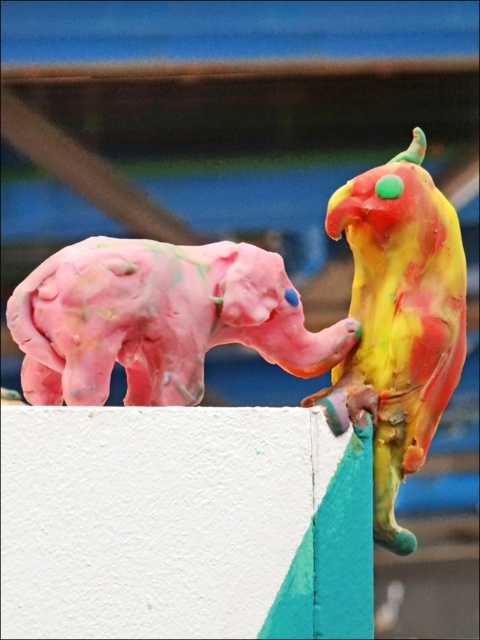
Question: Among these objects, which one is nearest to the camera?

Choices:
 (A) pink clay elephant at upper left
 (B) multicolored clay parrot at upper right
 (C) matte clay elephant at upper left

Answer: (A)

Question: Where is pink clay elephant at upper left located in relation to multicolored clay parrot at upper right in the image?

Choices:
 (A) left
 (B) right

Answer: (A)

Question: Is pink clay elephant at upper left smaller than multicolored clay parrot at upper right?

Choices:
 (A) yes
 (B) no

Answer: (A)

Question: Which point is farther to the camera?

Choices:
 (A) (428, 314)
 (B) (99, 349)

Answer: (A)

Question: Considering the relative positions of pink clay elephant at upper left and multicolored clay parrot at upper right in the image provided, where is pink clay elephant at upper left located with respect to multicolored clay parrot at upper right?

Choices:
 (A) below
 (B) above

Answer: (A)

Question: Which point is farther to the camera?

Choices:
 (A) (111, 340)
 (B) (153, 365)
 (C) (374, 417)

Answer: (C)